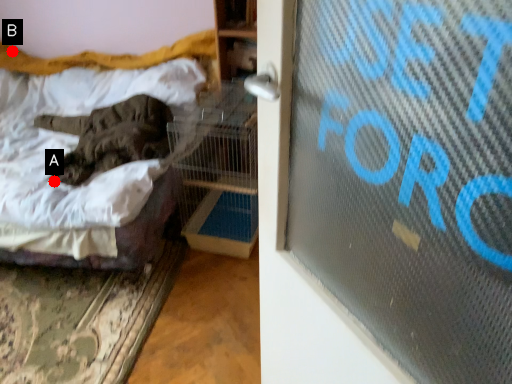
Question: Two points are circled on the image, labeled by A and B beside each circle. Among these points, which one is farthest from the camera?

Choices:
 (A) A is further
 (B) B is further

Answer: (B)